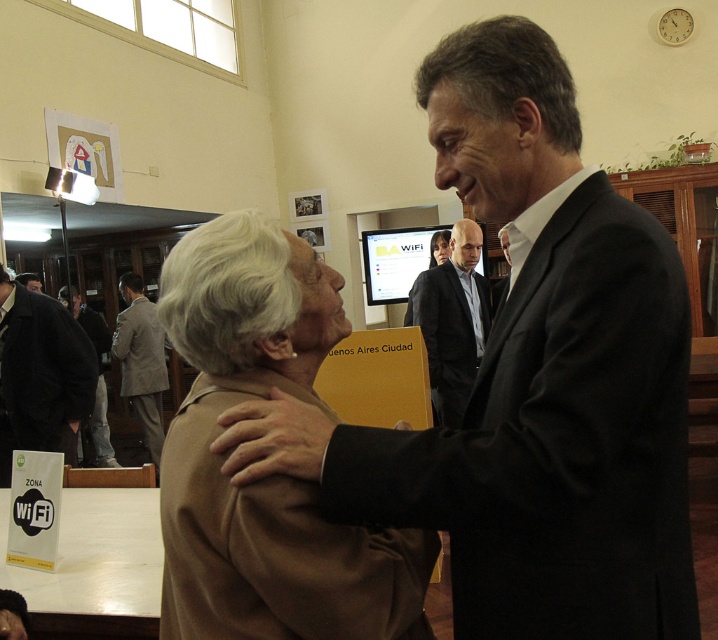
You are an interior designer assessing the placement of items in the room. You need to determine if the brown woolen coat at center can be moved to the same height as the brown leather jacket at lower left without overlapping any other objects. Can this be done based on their current positions?

The brown woolen coat at center is located above the brown leather jacket at lower left, so moving it down to the same height would require checking for space below. Since no other objects are mentioned in the description, it might be possible, but the answer should strictly use the given info. However, according to the rules, we can only use the provided details. Since the description only states their relative positions, the answer should state the coat is above, so moving it down to the jacket level is a

You are standing in the room and want to touch the black leather jacket at left. Which direction should you move to reach it?

Since the black leather jacket at left is located at point (x=42, y=369), you should move to the left side of the room to reach it.

You are standing in the room and want to touch the black leather jacket at left. If you move forward 0.5 meters from your current position, will you reach it?

The black leather jacket at left is positioned at point (42, 369). Moving forward 0.5 meters might not be sufficient to reach it since the exact distance isn